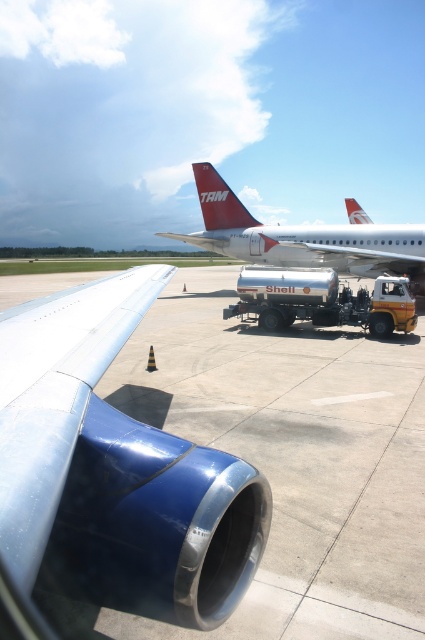
Who is more distant from viewer, (x=232, y=548) or (x=229, y=220)?

Positioned behind is point (x=229, y=220).

Where is `blue metallic engine at center`? blue metallic engine at center is located at coordinates (112, 476).

Find the location of a particular element. This screenshot has width=425, height=640. blue metallic engine at center is located at coordinates (112, 476).